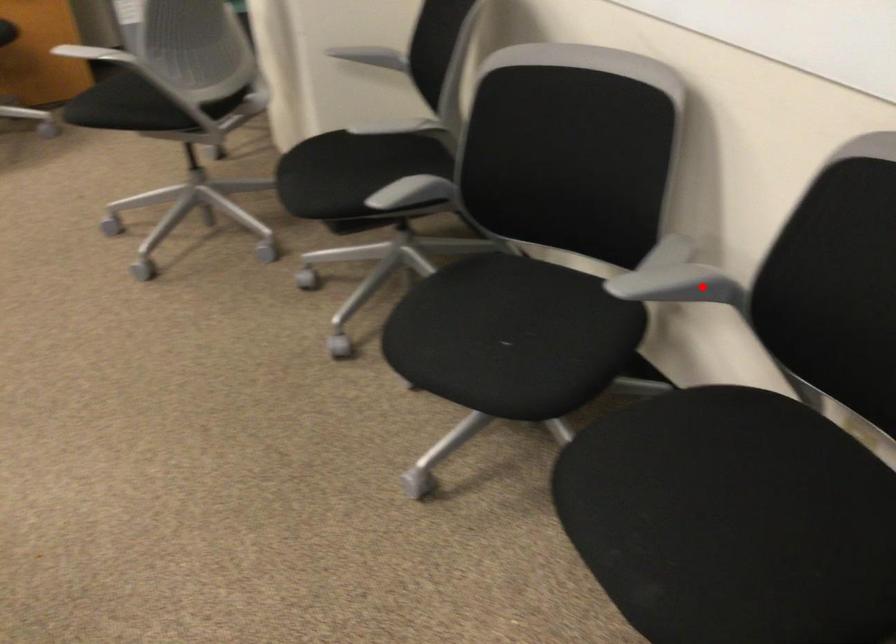
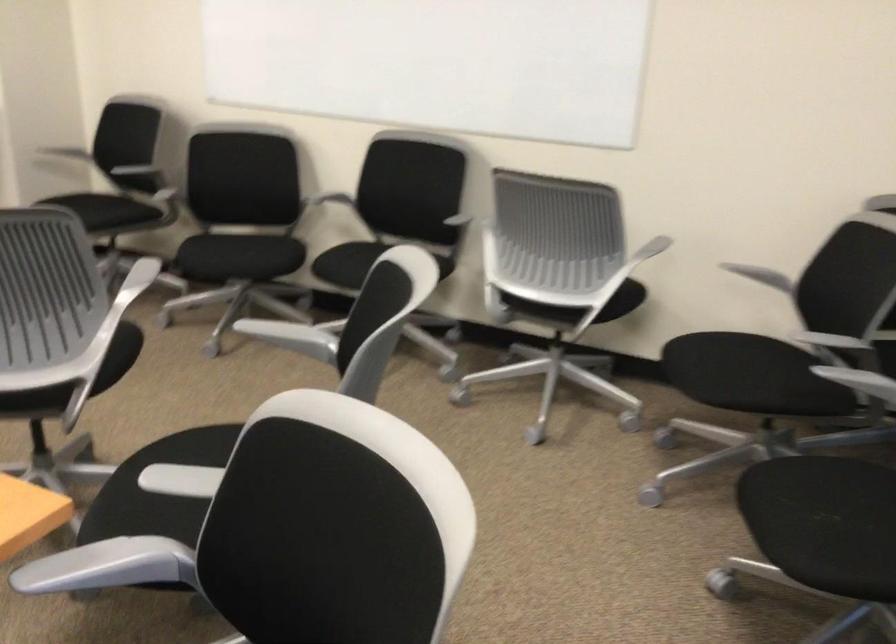
Locate, in the second image, the point that corresponds to the highlighted location in the first image.

(340, 196)